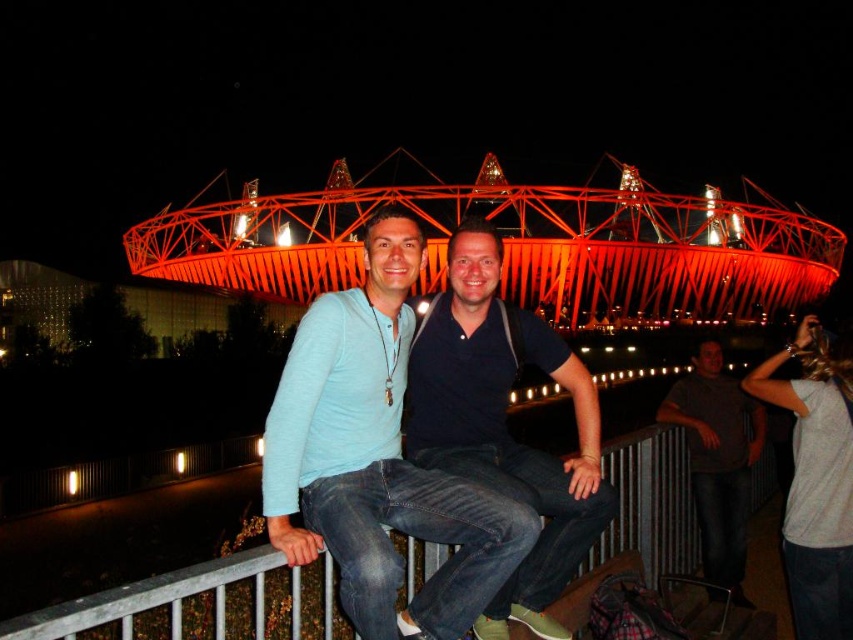
Can you confirm if metallic framework at center is wider than light blue denim jeans at center?

Indeed, metallic framework at center has a greater width compared to light blue denim jeans at center.

Is metallic framework at center to the left of light blue denim jeans at center from the viewer's perspective?

In fact, metallic framework at center is to the right of light blue denim jeans at center.

Who is more distant from viewer, (694,224) or (399,513)?

The point (694,224) is behind.

Locate an element on the screen. The image size is (853, 640). metallic framework at center is located at coordinates (515, 244).

Who is shorter, light blue denim jeans at center or dark blue shirt at center?

light blue denim jeans at center is shorter.

Is light blue denim jeans at center below dark blue shirt at center?

No.

Between point (416, 608) and point (479, 312), which one is positioned behind?

Point (479, 312)

Image resolution: width=853 pixels, height=640 pixels. I want to click on light blue denim jeans at center, so click(x=376, y=460).

Is point (480, 604) closer to camera compared to point (718, 394)?

That is True.

This screenshot has height=640, width=853. I want to click on light blue denim jeans at center, so click(376, 460).